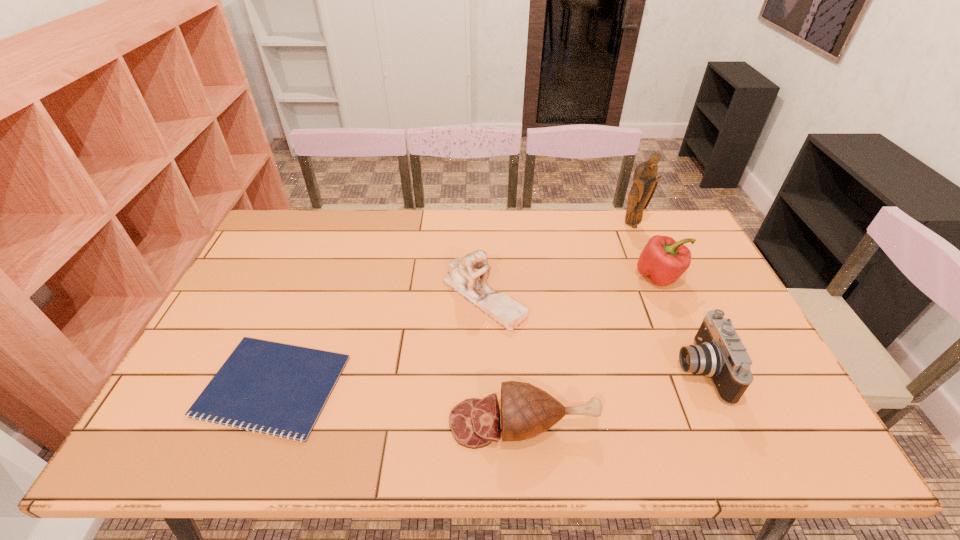
Identify the location of free spot between the camera and the right figurine. (666, 298).

You are a GUI agent. You are given a task and a screenshot of the screen. Output one action in this format:
    pyautogui.click(x=<x>, y=<y>)
    Task: Click on the empty space between the camera and the bell pepper
    
    Given the screenshot: What is the action you would take?
    pyautogui.click(x=680, y=323)

This screenshot has height=540, width=960. I want to click on object that is the fourth closest one to the shorter figurine, so click(718, 353).

At what (x,y) coordinates should I click in order to perform the action: click on object that is the second closest to the bell pepper. Please return your answer as a coordinate pair (x, y). The width and height of the screenshot is (960, 540). Looking at the image, I should click on (718, 353).

Image resolution: width=960 pixels, height=540 pixels. Find the location of `free space that satisfies the following two spatial constraints: 1. on the front-facing side of the tallest object; 2. at the sliced end of the ham`. free space that satisfies the following two spatial constraints: 1. on the front-facing side of the tallest object; 2. at the sliced end of the ham is located at coordinates (714, 422).

You are a GUI agent. You are given a task and a screenshot of the screen. Output one action in this format:
    pyautogui.click(x=<x>, y=<y>)
    Task: Click on the vacant space that satisfies the following two spatial constraints: 1. on the front-facing side of the tallest object; 2. on the right side of the bell pepper
    The width and height of the screenshot is (960, 540).
    Given the screenshot: What is the action you would take?
    pyautogui.click(x=653, y=276)

I want to click on vacant space that satisfies the following two spatial constraints: 1. on the front-facing side of the camera; 2. on the front side of the shortest object, so (708, 386).

At what (x,y) coordinates should I click in order to perform the action: click on free space that satisfies the following two spatial constraints: 1. on the front-facing side of the tallest object; 2. at the sliced end of the fifth tallest object. Please return your answer as a coordinate pair (x, y). The width and height of the screenshot is (960, 540). Looking at the image, I should click on (714, 422).